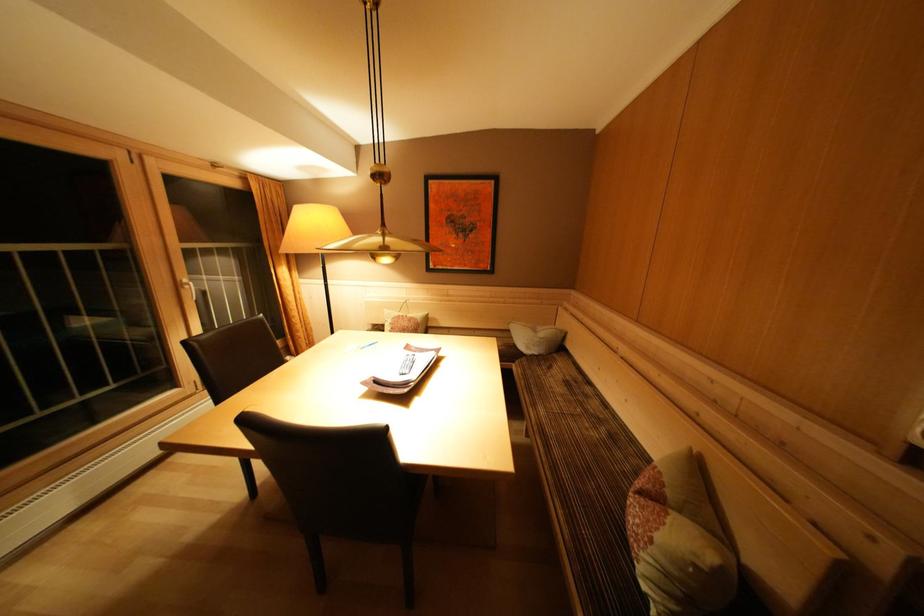
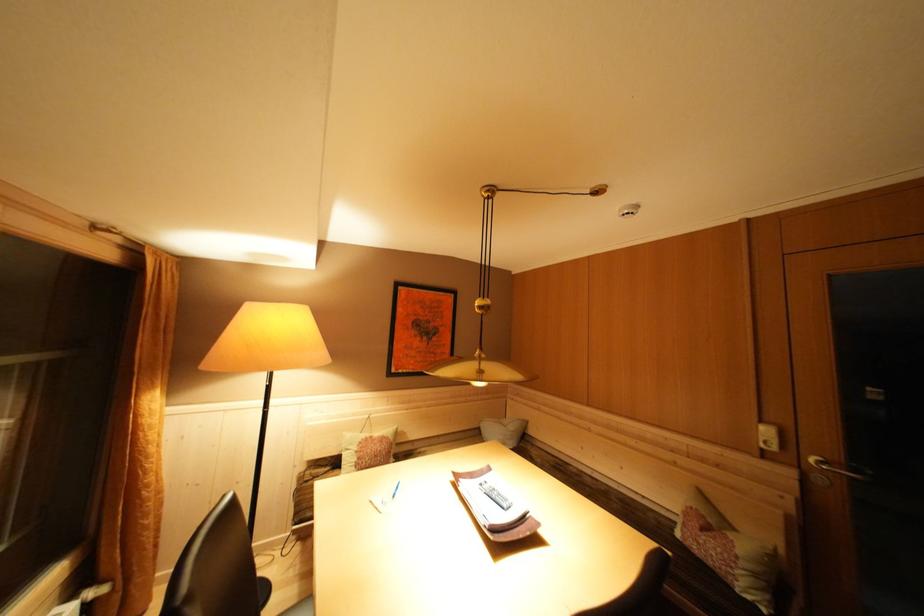
Find the pixel in the second image that matches point 552,338 in the first image.

(518, 430)